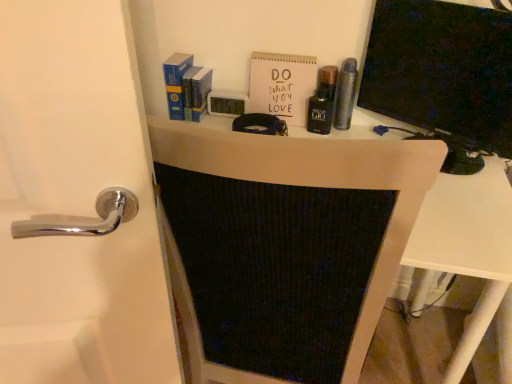
Question: Is there a large distance between white matte paper at upper center and matte black monitor at right?

Choices:
 (A) yes
 (B) no

Answer: (B)

Question: Can you confirm if white matte paper at upper center is wider than matte black monitor at right?

Choices:
 (A) no
 (B) yes

Answer: (A)

Question: Could you tell me if white matte paper at upper center is turned towards matte black monitor at right?

Choices:
 (A) no
 (B) yes

Answer: (A)

Question: Can you confirm if white matte paper at upper center is smaller than matte black monitor at right?

Choices:
 (A) yes
 (B) no

Answer: (A)

Question: Can you confirm if white matte paper at upper center is bigger than matte black monitor at right?

Choices:
 (A) no
 (B) yes

Answer: (A)

Question: Relative to matte black monitor at center, is black glass bottle at upper center, the 1th toiletry from the left, in front or behind?

Choices:
 (A) front
 (B) behind

Answer: (B)

Question: From a real-world perspective, is black glass bottle at upper center, placed as the second toiletry when sorted from right to left, above or below matte black monitor at center?

Choices:
 (A) below
 (B) above

Answer: (B)

Question: Is black glass bottle at upper center, the 1th toiletry from the left, to the left or to the right of matte black monitor at center in the image?

Choices:
 (A) left
 (B) right

Answer: (B)

Question: From the image's perspective, is black glass bottle at upper center, the 1th toiletry from the left, positioned above or below matte black monitor at center?

Choices:
 (A) below
 (B) above

Answer: (B)

Question: Considering the positions of matte black monitor at right and black glass bottle at upper center, placed as the second toiletry when sorted from right to left, in the image, is matte black monitor at right bigger or smaller than black glass bottle at upper center, placed as the second toiletry when sorted from right to left,?

Choices:
 (A) big
 (B) small

Answer: (A)

Question: From a real-world perspective, is matte black monitor at right positioned above or below black glass bottle at upper center, the 1th toiletry from the left?

Choices:
 (A) above
 (B) below

Answer: (A)

Question: Considering the relative positions of matte black monitor at right and black glass bottle at upper center, placed as the second toiletry when sorted from right to left, in the image provided, is matte black monitor at right to the left or to the right of black glass bottle at upper center, placed as the second toiletry when sorted from right to left,?

Choices:
 (A) left
 (B) right

Answer: (B)

Question: Is matte black monitor at right in front of or behind black glass bottle at upper center, the 1th toiletry from the left, in the image?

Choices:
 (A) behind
 (B) front

Answer: (B)

Question: Looking at their shapes, would you say metallic silver canister at center, the first toiletry when ordered from right to left, is wider or thinner than matte black monitor at right?

Choices:
 (A) thin
 (B) wide

Answer: (A)

Question: From the image's perspective, relative to matte black monitor at right, is metallic silver canister at center, the first toiletry when ordered from right to left, above or below?

Choices:
 (A) below
 (B) above

Answer: (B)